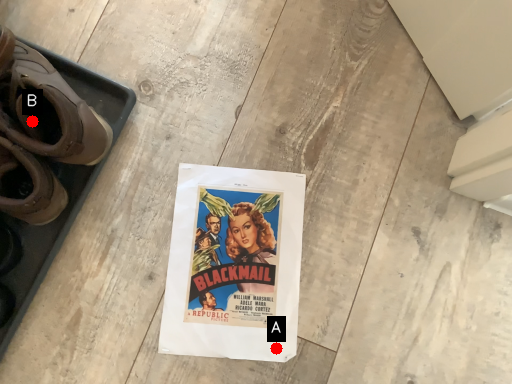
Question: Two points are circled on the image, labeled by A and B beside each circle. Which point is closer to the camera?

Choices:
 (A) A is closer
 (B) B is closer

Answer: (B)